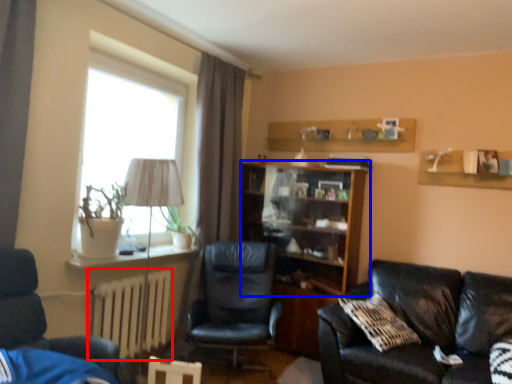
Question: Which object appears closest to the camera in this image, radiator (highlighted by a red box) or shelf (highlighted by a blue box)?

Choices:
 (A) radiator
 (B) shelf

Answer: (A)